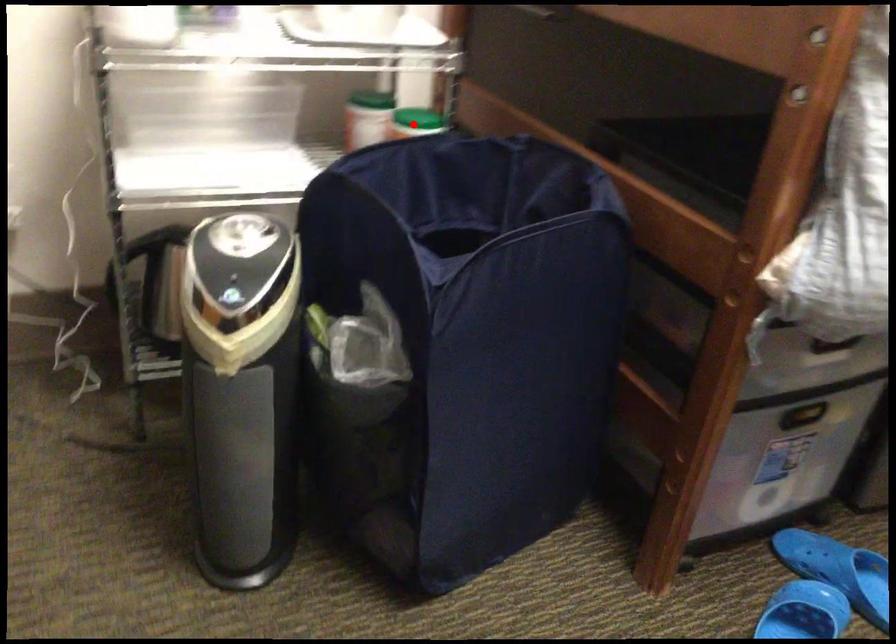
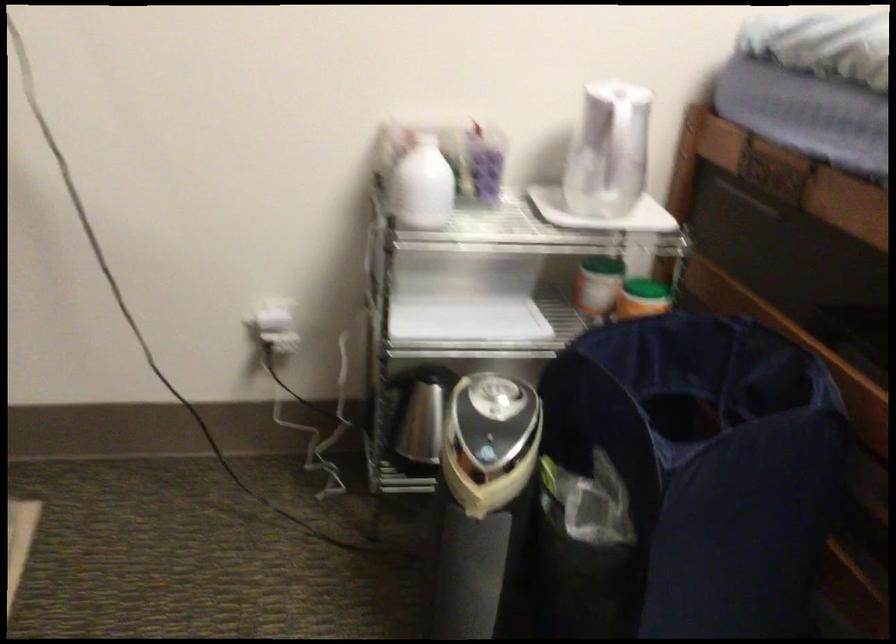
Question: A red point is marked in image1. In image2, is the corresponding 3D point closer to the camera or farther? Reply with the corresponding letter.

Choices:
 (A) The corresponding 3D point is closer.
 (B) The corresponding 3D point is farther.

Answer: (B)